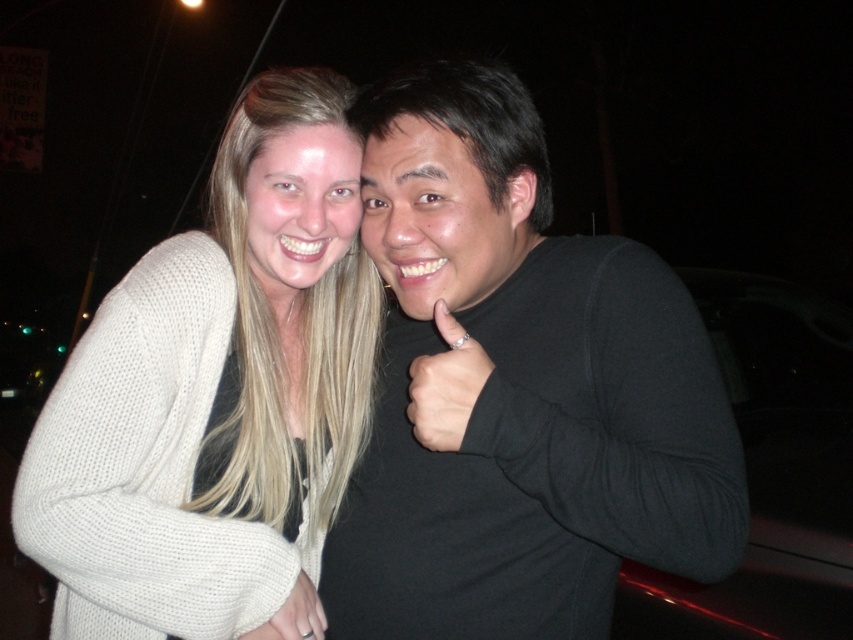
Based on the photo, you are a photographer trying to capture the perfect shot of the two people in the image. You want to ensure that both the white knitted cardigan at upper left and the black matte hand at center are clearly visible in your frame. Based on their positions, which object should you focus on first to ensure both are in focus?

Since the white knitted cardigan at upper left is to the left of the black matte hand at center, you should focus on the white knitted cardigan at upper left first. This way, the distance between them allows both objects to be in focus when using a proper aperture setting.

You are standing in front of the two people in the image. There is a point at coordinates point (x=531, y=124) that is 1.11 meters away from you. If you want to touch this point with your hand, which of the two people would you need to move closer to?

The point (x=531, y=124) is 1.11 meters from the viewer, so you would need to move closer to the person on the left or the right, but since the point is at a fixed distance, you can reach it by moving forward to that distance regardless of the people.

You are a photographer setting up for a night portrait. You have two subjects wearing the black matte turtleneck at center and the white knitted cardigan at upper left. To ensure both outfits are clearly visible in the photo, which clothing item requires more lighting adjustment due to its size?

The black matte turtleneck at center requires more lighting adjustment because it is bigger than the white knitted cardigan at upper left, making it more prominent and needing proper illumination.